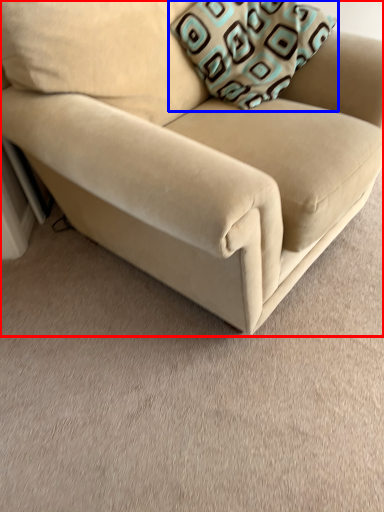
Question: Which of the following is the closest to the observer, studio couch (highlighted by a red box) or throw pillow (highlighted by a blue box)?

Choices:
 (A) studio couch
 (B) throw pillow

Answer: (A)